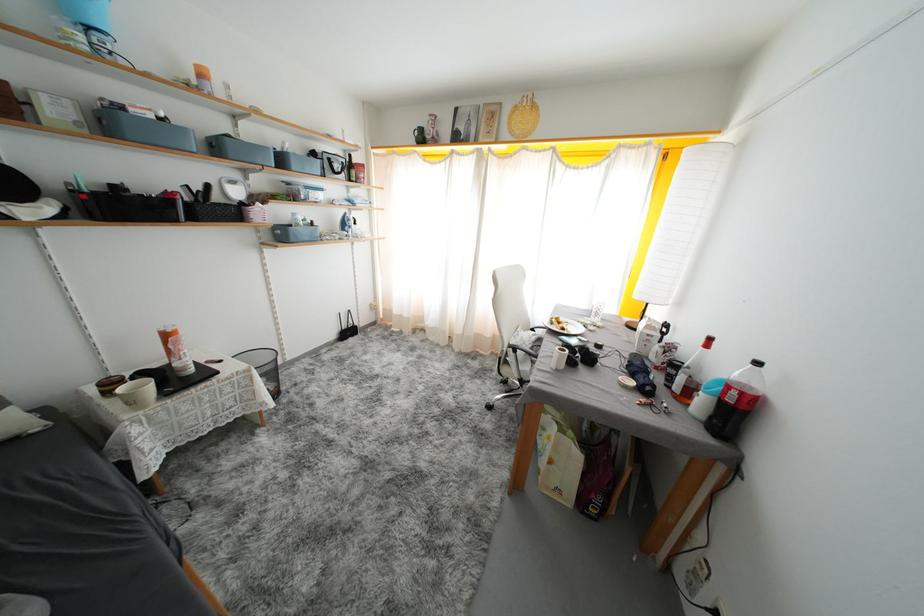
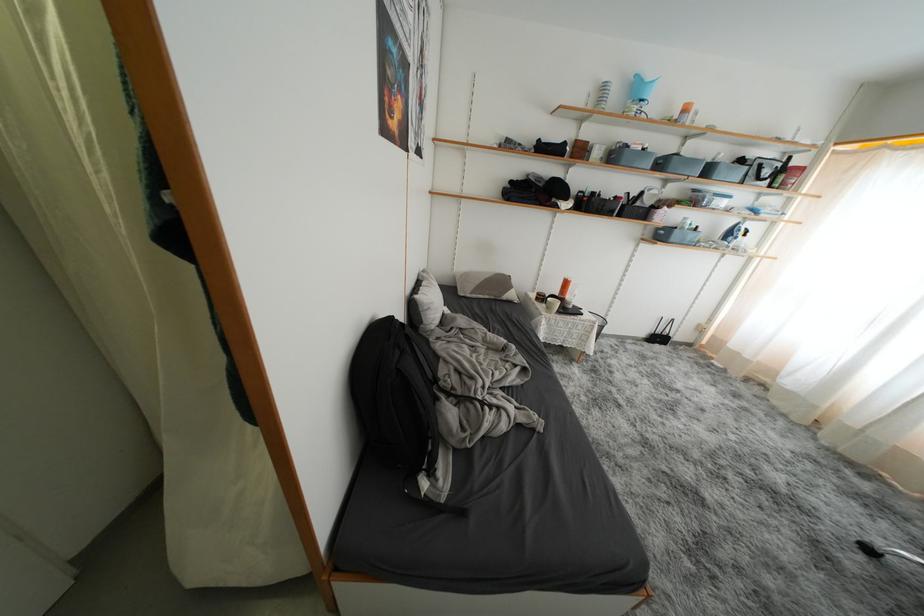
Where in the second image is the point corresponding to pixel 495 411 from the first image?

(876, 554)